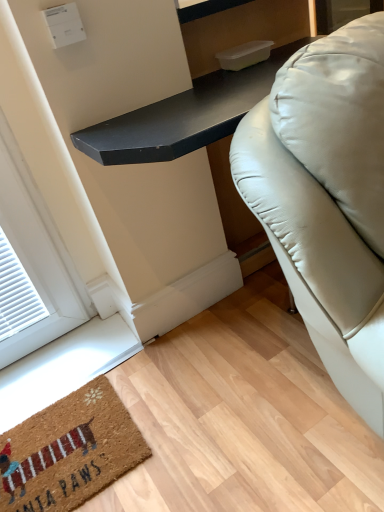
Measure the distance between point (88, 410) and camera.

A distance of 4.58 feet exists between point (88, 410) and camera.

Describe the element at coordinates (69, 451) in the screenshot. The width and height of the screenshot is (384, 512). I see `brown coir mat at lower left` at that location.

At what (x,y) coordinates should I click in order to perform the action: click on brown coir mat at lower left. Please return your answer as a coordinate pair (x, y). Looking at the image, I should click on (69, 451).

Image resolution: width=384 pixels, height=512 pixels. I want to click on black matte table at center, so click(x=207, y=98).

The height and width of the screenshot is (512, 384). What do you see at coordinates (207, 98) in the screenshot?
I see `black matte table at center` at bounding box center [207, 98].

This screenshot has width=384, height=512. Identify the location of brown coir mat at lower left. (69, 451).

Between black matte table at center and brown coir mat at lower left, which one appears on the left side from the viewer's perspective?

brown coir mat at lower left.

Between black matte table at center and brown coir mat at lower left, which one is positioned in front?

black matte table at center is closer to the camera.

Which is behind, point (156, 115) or point (58, 418)?

Positioned behind is point (58, 418).

From the image's perspective, which is below, black matte table at center or brown coir mat at lower left?

brown coir mat at lower left.

From a real-world perspective, who is located lower, black matte table at center or brown coir mat at lower left?

In real-world perspective, brown coir mat at lower left is lower.

Between black matte table at center and brown coir mat at lower left, which one has larger width?

black matte table at center is wider.

Can you confirm if black matte table at center is shorter than brown coir mat at lower left?

Incorrect, the height of black matte table at center does not fall short of that of brown coir mat at lower left.

Does black matte table at center have a smaller size compared to brown coir mat at lower left?

No.

Is black matte table at center not inside brown coir mat at lower left?

Yes, black matte table at center is located beyond the bounds of brown coir mat at lower left.

Is black matte table at center touching brown coir mat at lower left?

No, black matte table at center is not beside brown coir mat at lower left.

Is black matte table at center looking in the opposite direction of brown coir mat at lower left?

black matte table at center is not turned away from brown coir mat at lower left.

How much distance is there between black matte table at center and brown coir mat at lower left?

black matte table at center and brown coir mat at lower left are 36.66 inches apart from each other.

The image size is (384, 512). In order to click on table that is above the brown coir mat at lower left (from a real-world perspective) in this screenshot , I will do `click(207, 98)`.

Considering the positions of objects brown coir mat at lower left and black matte table at center in the image provided, who is more to the right, brown coir mat at lower left or black matte table at center?

black matte table at center is more to the right.

Is brown coir mat at lower left in front of or behind black matte table at center in the image?

brown coir mat at lower left is positioned farther from the viewer than black matte table at center.

Does point (24, 511) come closer to viewer compared to point (219, 72)?

Yes.

From the image's perspective, is brown coir mat at lower left located above or below black matte table at center?

brown coir mat at lower left is situated lower than black matte table at center in the image.

In the scene shown: From a real-world perspective, does brown coir mat at lower left sit lower than black matte table at center?

Yes.

Which of these two, brown coir mat at lower left or black matte table at center, is wider?

black matte table at center.

Who is shorter, brown coir mat at lower left or black matte table at center?

Standing shorter between the two is brown coir mat at lower left.

Does brown coir mat at lower left have a larger size compared to black matte table at center?

Actually, brown coir mat at lower left might be smaller than black matte table at center.

Which is correct: brown coir mat at lower left is inside black matte table at center, or outside of it?

brown coir mat at lower left is not enclosed by black matte table at center.

Are brown coir mat at lower left and black matte table at center far apart?

brown coir mat at lower left is actually quite close to black matte table at center.

Does brown coir mat at lower left turn towards black matte table at center?

No, brown coir mat at lower left is not aimed at black matte table at center.

Consider the image. How different are the orientations of brown coir mat at lower left and black matte table at center in degrees?

The facing directions of brown coir mat at lower left and black matte table at center are 0.0971 degrees apart.

How far apart are brown coir mat at lower left and black matte table at center?

36.66 inches.

Where is `table above the brown coir mat at lower left (from a real-world perspective)`? The height and width of the screenshot is (512, 384). table above the brown coir mat at lower left (from a real-world perspective) is located at coordinates (207, 98).

In the image, there is a brown coir mat at lower left. Where is `table above it (from the image's perspective)`? This screenshot has height=512, width=384. table above it (from the image's perspective) is located at coordinates (207, 98).

The height and width of the screenshot is (512, 384). In order to click on mat on the left of black matte table at center in this screenshot , I will do `click(69, 451)`.